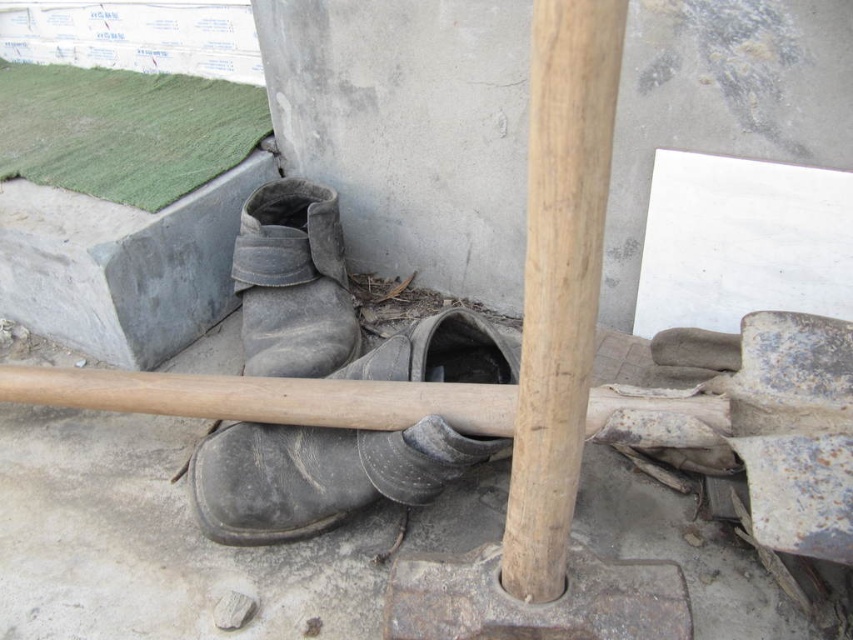
Is rusty metal shovel at center thinner than smooth wood pole at center?

No.

Is point (42, 392) more distant than point (575, 266)?

Yes, point (42, 392) is behind point (575, 266).

Find the location of a particular element. rusty metal shovel at center is located at coordinates (764, 428).

Between smooth wood pole at center and worn leather boot at center, which one appears on the right side from the viewer's perspective?

smooth wood pole at center is more to the right.

At what (x,y) coordinates should I click in order to perform the action: click on smooth wood pole at center. Please return your answer as a coordinate pair (x, y). Image resolution: width=853 pixels, height=640 pixels. Looking at the image, I should click on (560, 280).

Does rusty metal shovel at center lie in front of leather boot at center?

Yes, rusty metal shovel at center is closer to the viewer.

In the scene shown: Can you confirm if rusty metal shovel at center is bigger than leather boot at center?

Indeed, rusty metal shovel at center has a larger size compared to leather boot at center.

This screenshot has width=853, height=640. What do you see at coordinates (764, 428) in the screenshot?
I see `rusty metal shovel at center` at bounding box center [764, 428].

This screenshot has width=853, height=640. Identify the location of rusty metal shovel at center. (764, 428).